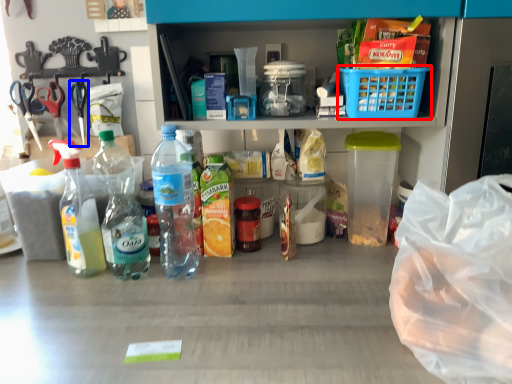
Question: Which object appears closest to the camera in this image, basket (highlighted by a red box) or scissors (highlighted by a blue box)?

Choices:
 (A) basket
 (B) scissors

Answer: (A)